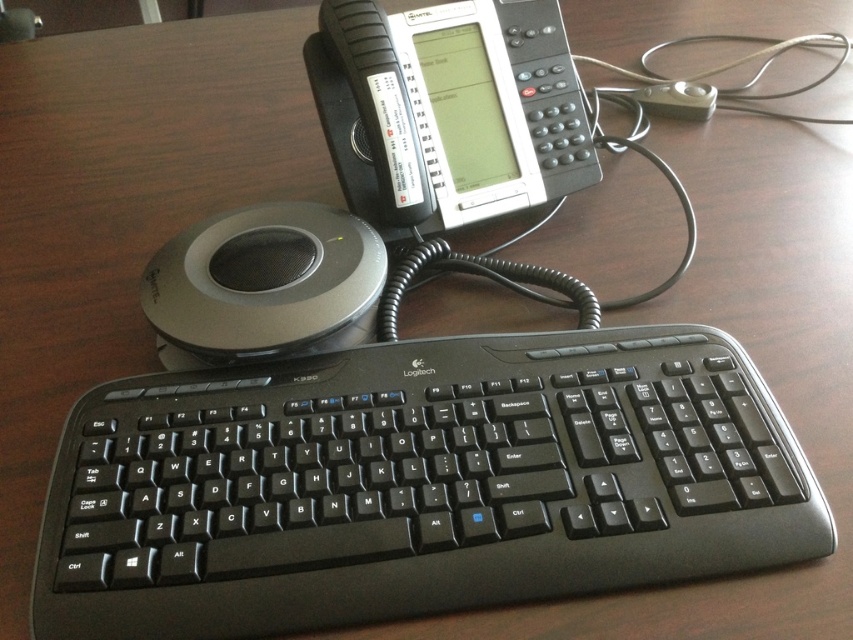
Who is positioned more to the right, black plastic keyboard at center or black plastic phone at upper center?

black plastic phone at upper center

Can you confirm if black plastic keyboard at center is taller than black plastic phone at upper center?

No, black plastic keyboard at center is not taller than black plastic phone at upper center.

Who is more forward, [349,596] or [318,60]?

Positioned in front is point [349,596].

Identify the location of black plastic keyboard at center. (416, 484).

Is black plastic keyboard at center bigger than silver/metallic speaker at left?

Yes.

What do you see at coordinates (416, 484) in the screenshot? I see `black plastic keyboard at center` at bounding box center [416, 484].

Does point (283, 410) come farther from viewer compared to point (248, 332)?

No.

Locate an element on the screen. The image size is (853, 640). black plastic keyboard at center is located at coordinates (416, 484).

Does point (511, 48) come behind point (285, 244)?

Yes, it is.

Does point (485, 161) lie behind point (178, 291)?

Yes, it is.

Where is `black plastic phone at upper center`? The width and height of the screenshot is (853, 640). black plastic phone at upper center is located at coordinates (492, 106).